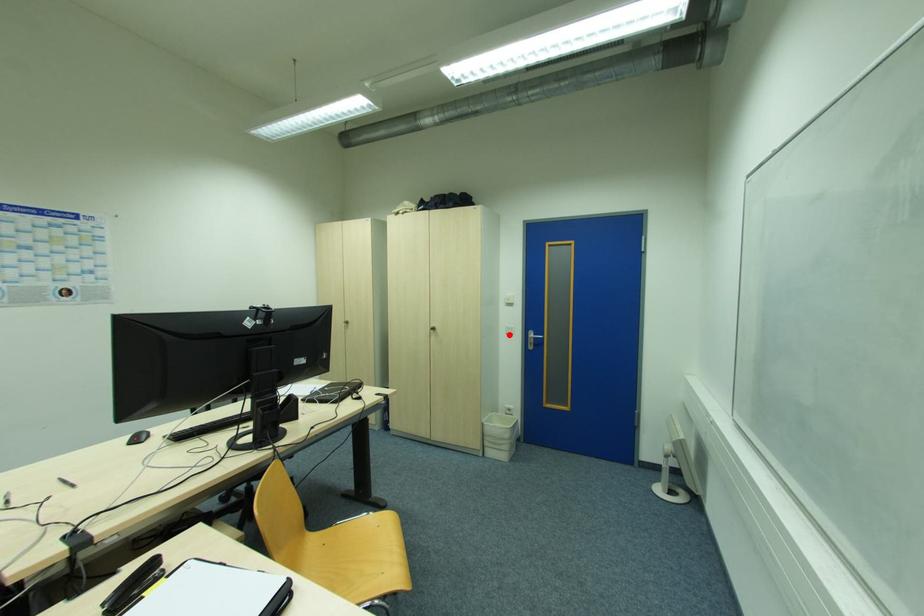
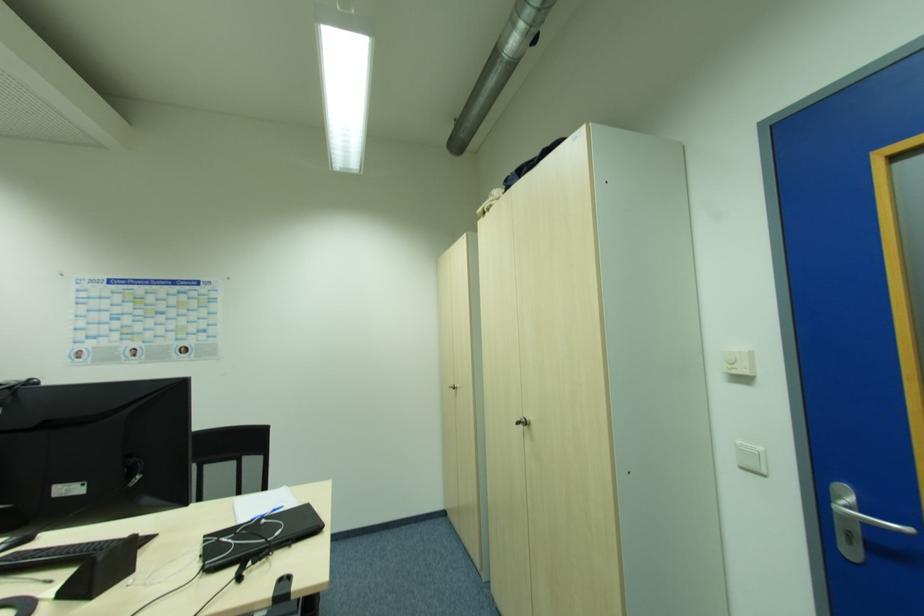
Locate, in the second image, the point that corresponds to the highlighted location in the first image.

(746, 469)